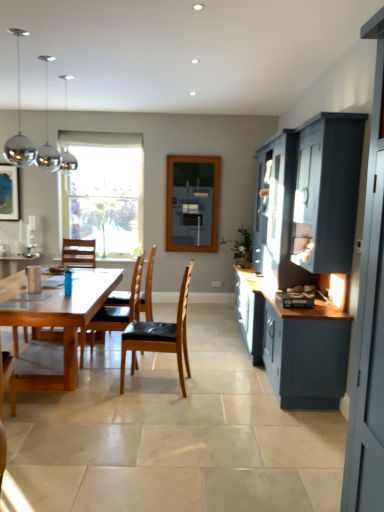
Where is `free point in front of light brown wooden chair at center, acting as the 1th chair starting from the front`? This screenshot has width=384, height=512. free point in front of light brown wooden chair at center, acting as the 1th chair starting from the front is located at coordinates (150, 408).